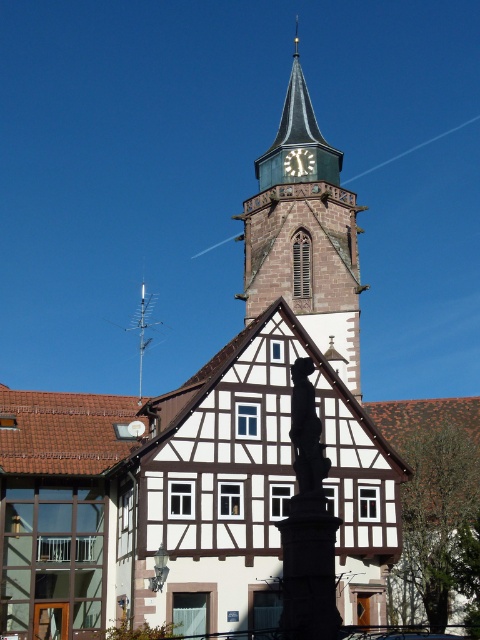
You are standing in the middle of the square and want to take a photo of the smooth gray stone clock tower at center. Where should you position yourself to ensure the clock tower is centered in your camera frame?

To center the smooth gray stone clock tower at center in your camera frame, position yourself directly in front of it at the coordinates corresponding to its central point, which is at point [304,237].

You are a tourist standing in front of the historic church tower and the traditional half timbered building. You notice a point marked at coordinate (143,328). What object is located at this coordinate?

The point at coordinate (143,328) marks the location of the silver metallic antenna at upper center.